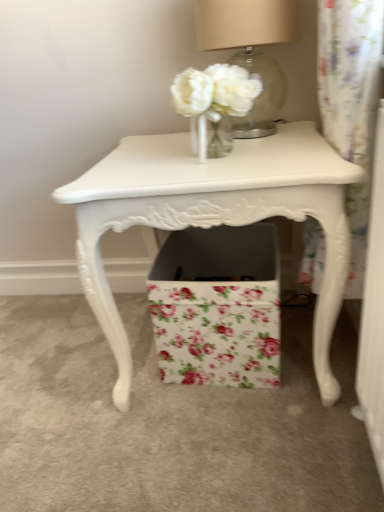
This screenshot has height=512, width=384. Find the location of `vacant region in front of white painted wood table at center`. vacant region in front of white painted wood table at center is located at coordinates (220, 457).